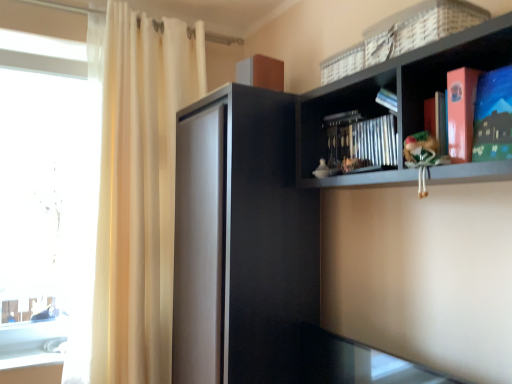
Describe the element at coordinates (419, 27) in the screenshot. I see `white woven basket at upper right` at that location.

Locate an element on the screen. The width and height of the screenshot is (512, 384). white woven basket at upper right is located at coordinates (419, 27).

The height and width of the screenshot is (384, 512). Find the location of `black matte shelf at upper right`. black matte shelf at upper right is located at coordinates (397, 95).

Identify the location of metallic silver book at center. (361, 142).

What is the approximate height of transparent glass window at left?

transparent glass window at left is 1.50 meters tall.

Identify the location of matte paper book at upper right. (493, 116).

Measure the distance between white sheer curtain at left and camera.

white sheer curtain at left and camera are 5.91 feet apart from each other.

Find the location of a particular element. The image size is (512, 384). white woven basket at upper right is located at coordinates (419, 27).

Which is more to the left, white sheer curtain at left or transparent glass window at left?

From the viewer's perspective, transparent glass window at left appears more on the left side.

Which of these two, white sheer curtain at left or transparent glass window at left, is wider?

white sheer curtain at left.

Is there a large distance between metallic silver book at center and green fabric doll at right?

Actually, metallic silver book at center and green fabric doll at right are a little close together.

Which is less distant, (383, 136) or (419, 137)?

The point (419, 137) is closer.

Between metallic silver book at center and green fabric doll at right, which one has less height?

metallic silver book at center is shorter.

Looking at this image, which object is further away from the camera taking this photo, metallic silver book at center or green fabric doll at right?

metallic silver book at center is behind.

How far apart are black matte cabinet at center and matte paper book at upper right?

black matte cabinet at center is 86.85 centimeters from matte paper book at upper right.

Which is farther from the camera, (306, 255) or (483, 143)?

The point (306, 255) is behind.

Does black matte cabinet at center turn towards matte paper book at upper right?

No, black matte cabinet at center is not oriented towards matte paper book at upper right.

From the picture: Do you think black matte cabinet at center is within matte paper book at upper right, or outside of it?

black matte cabinet at center is spatially situated outside matte paper book at upper right.

Which is nearer, (408, 164) or (430, 20)?

Clearly, point (408, 164) is more distant from the camera than point (430, 20).

Which is more to the left, green fabric doll at right or white woven basket at upper right?

From the viewer's perspective, green fabric doll at right appears more on the left side.

Is green fabric doll at right not close to white woven basket at upper right?

green fabric doll at right is actually quite close to white woven basket at upper right.

How many degrees apart are the facing directions of green fabric doll at right and white woven basket at upper right?

They differ by 1.65 degrees in their facing directions.

Considering the positions of objects white sheer curtain at left and black matte shelf at upper right in the image provided, who is more to the left, white sheer curtain at left or black matte shelf at upper right?

white sheer curtain at left.

Considering the relative sizes of white sheer curtain at left and black matte shelf at upper right in the image provided, is white sheer curtain at left shorter than black matte shelf at upper right?

No.

Which object is thinner, white sheer curtain at left or black matte shelf at upper right?

Thinner between the two is black matte shelf at upper right.

How much distance is there between white sheer curtain at left and black matte shelf at upper right?

white sheer curtain at left is 38.01 inches away from black matte shelf at upper right.

Does point (503, 108) lie in front of point (424, 197)?

Yes, point (503, 108) is in front of point (424, 197).

In the scene shown: How many degrees apart are the facing directions of matte paper book at upper right and green fabric doll at right?

The angle between the facing direction of matte paper book at upper right and the facing direction of green fabric doll at right is 2.39 degrees.

Consider the image. From a real-world perspective, is matte paper book at upper right under green fabric doll at right?

No.

Find the location of `toy located underneath the matte paper book at upper right (from a real-world perspective)`. toy located underneath the matte paper book at upper right (from a real-world perspective) is located at coordinates (422, 157).

Is white sheer curtain at left looking in the opposite direction of black matte cabinet at center?

No, white sheer curtain at left's orientation is not away from black matte cabinet at center.

Considering the sizes of objects white sheer curtain at left and black matte cabinet at center in the image provided, who is smaller, white sheer curtain at left or black matte cabinet at center?

black matte cabinet at center.

I want to click on screen door below the white sheer curtain at left (from a real-world perspective), so (x=241, y=241).

How different are the orientations of white sheer curtain at left and black matte cabinet at center in degrees?

There is a 88.2-degree angle between the facing directions of white sheer curtain at left and black matte cabinet at center.

Find the location of `curtain to the right of transparent glass window at left`. curtain to the right of transparent glass window at left is located at coordinates (139, 191).

Identify the location of book that is behind the green fabric doll at right. Image resolution: width=512 pixels, height=384 pixels. click(x=361, y=142).

Considering their positions, is transparent glass window at left positioned further to matte paper book at upper right than black matte shelf at upper right?

transparent glass window at left is positioned further to the anchor matte paper book at upper right.

Which object lies further to the anchor point white sheer curtain at left, matte paper book at upper right or black matte cabinet at center?

Among the two, matte paper book at upper right is located further to white sheer curtain at left.

Which object lies further to the anchor point metallic silver book at center, black matte shelf at upper right or matte paper book at upper right?

matte paper book at upper right.

Which object lies further to the anchor point metallic silver book at center, matte paper book at upper right or white woven basket at upper right?

The object further to metallic silver book at center is matte paper book at upper right.

In the scene shown: Looking at the image, which one is located further to black matte shelf at upper right, green fabric doll at right or white woven basket at upper right?

green fabric doll at right is positioned further to the anchor black matte shelf at upper right.

Considering their positions, is black matte cabinet at center positioned closer to matte paper book at upper right than white sheer curtain at left?

Among the two, black matte cabinet at center is located nearer to matte paper book at upper right.

Estimate the real-world distances between objects in this image. Which object is closer to matte paper book at upper right, transparent glass window at left or black matte cabinet at center?

Based on the image, black matte cabinet at center appears to be nearer to matte paper book at upper right.

Estimate the real-world distances between objects in this image. Which object is further from white woven basket at upper right, black matte cabinet at center or transparent glass window at left?

transparent glass window at left.

Locate an element on the screen. The image size is (512, 384). screen door between white sheer curtain at left and white woven basket at upper right from left to right is located at coordinates (241, 241).

Identify the location of curtain between transparent glass window at left and metallic silver book at center in the horizontal direction. The height and width of the screenshot is (384, 512). (139, 191).

Find the location of `toy positioned between matte paper book at upper right and metallic silver book at center from near to far`. toy positioned between matte paper book at upper right and metallic silver book at center from near to far is located at coordinates (422, 157).

You are a GUI agent. You are given a task and a screenshot of the screen. Output one action in this format:
    pyautogui.click(x=<x>, y=<y>)
    Task: Click on the basket between white sheer curtain at left and matte paper book at upper right in the horizontal direction
    Image resolution: width=512 pixels, height=384 pixels.
    Given the screenshot: What is the action you would take?
    [x=419, y=27]